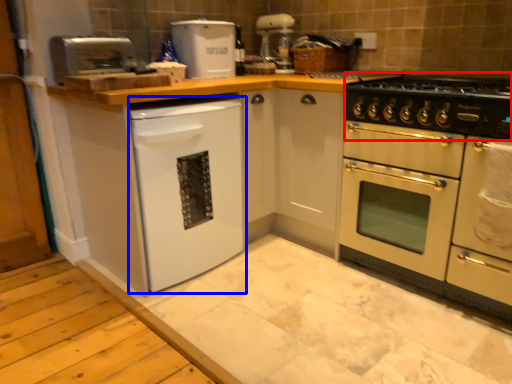
Question: Among these objects, which one is farthest to the camera, gas stove (highlighted by a red box) or dish washer (highlighted by a blue box)?

Choices:
 (A) gas stove
 (B) dish washer

Answer: (B)